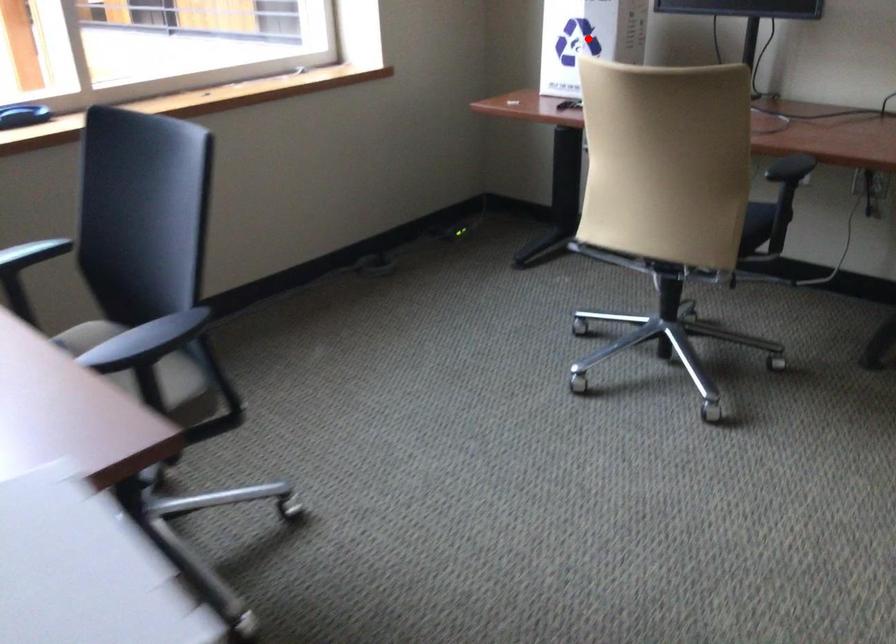
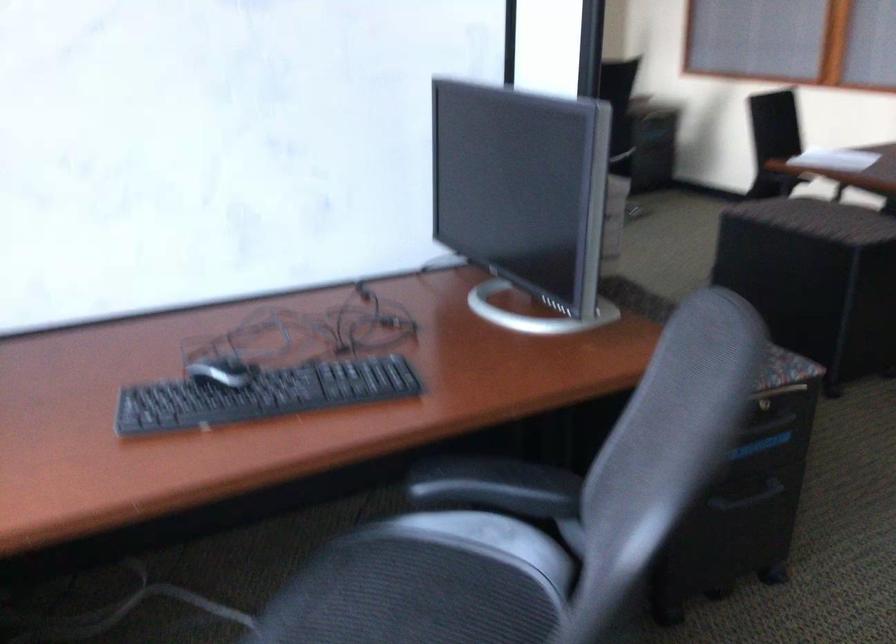
Question: I am providing you with two images of the same scene from different viewpoints. A red point is marked on the first image. Is the red point's position out of view in image 2?

Choices:
 (A) Yes
 (B) No

Answer: (A)